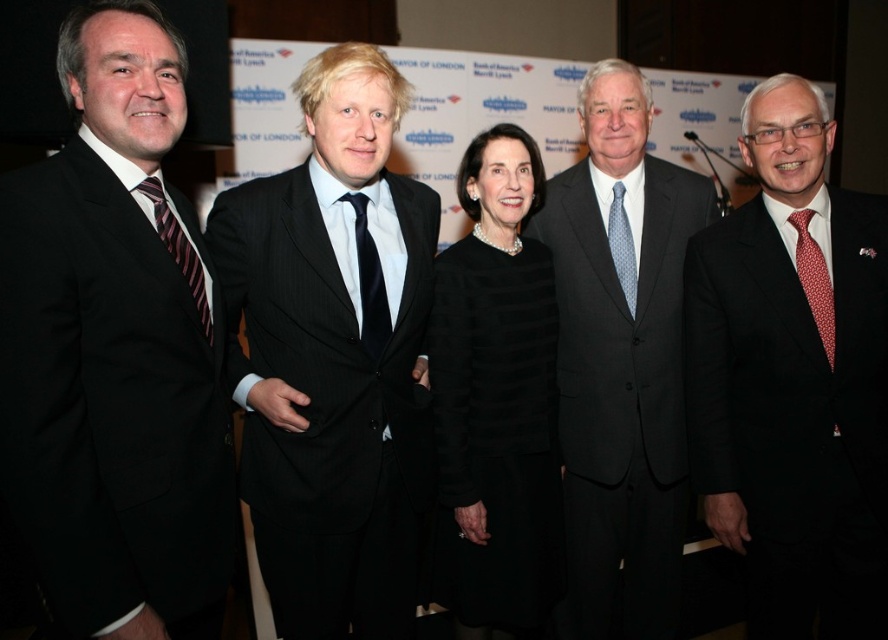
Describe the element at coordinates (369, 282) in the screenshot. I see `black silk tie at center` at that location.

Looking at this image, can you confirm if black silk tie at center is positioned above blue dotted tie at center?

Actually, black silk tie at center is below blue dotted tie at center.

At what (x,y) coordinates should I click in order to perform the action: click on black silk tie at center. Please return your answer as a coordinate pair (x, y). Looking at the image, I should click on (369, 282).

Identify the location of black silk tie at center. (369, 282).

Who is positioned more to the right, black pinstripe suit at center or matte black suit at right?

From the viewer's perspective, matte black suit at right appears more on the right side.

Find the location of a particular element. This screenshot has height=640, width=888. black pinstripe suit at center is located at coordinates (333, 356).

Does point (346, 193) come in front of point (744, 474)?

Yes, point (346, 193) is in front of point (744, 474).

The width and height of the screenshot is (888, 640). Find the location of `black pinstripe suit at center`. black pinstripe suit at center is located at coordinates (333, 356).

Is matte black suit at center to the left of red dotted tie at right from the viewer's perspective?

Correct, you'll find matte black suit at center to the left of red dotted tie at right.

Can you confirm if matte black suit at center is taller than red dotted tie at right?

Yes, matte black suit at center is taller than red dotted tie at right.

Which is behind, point (530, 227) or point (827, 356)?

Positioned behind is point (530, 227).

This screenshot has width=888, height=640. I want to click on matte black suit at center, so click(x=620, y=365).